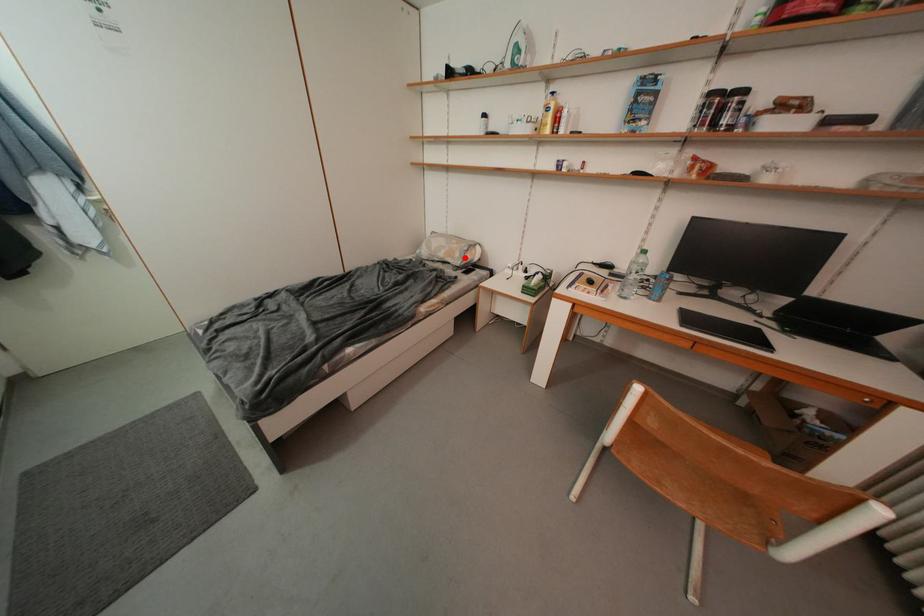
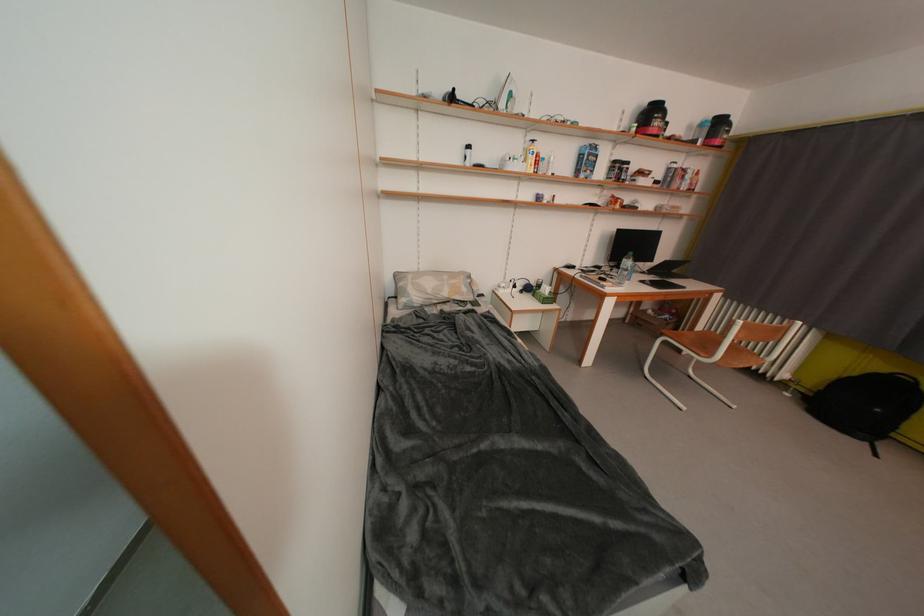
Question: A red point is marked in image1. In image2, is the corresponding 3D point closer to the camera or farther? Reply with the corresponding letter.

Choices:
 (A) The corresponding 3D point is closer.
 (B) The corresponding 3D point is farther.

Answer: (B)